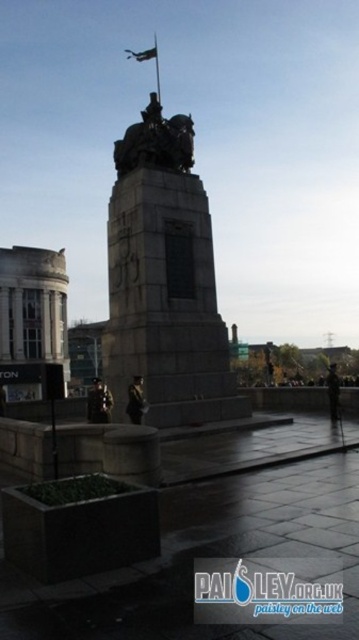
You are a drone operator who needs to fly a drone from the metallic statue at center to the metallic flag at upper center. What is the minimum distance the drone must travel to reach the flag from the statue?

The metallic statue at center and metallic flag at upper center are 44.42 meters apart from each other, so the drone must travel at least 44.42 meters to reach the flag from the statue.

You are a visitor approaching the monument and want to take a photo of the stone statue at center without the dark uniformed figure at center appearing in the frame. How can you adjust your position to achieve this?

Since the stone statue at center is in front of the dark uniformed figure at center, you can move to the side so that the statue blocks the view of the figure, ensuring only the statue is in the frame.

You are a photographer standing at the base of the monument and want to take a picture. You notice two points marked in the scene. Which point, point (106, 404) or point (336, 371), is closer to your camera position?

Point (106, 404) is closer to the camera than point (336, 371).